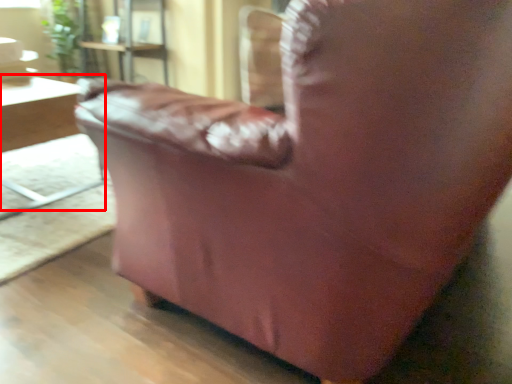
Question: From the image's perspective, where is table (annotated by the red box) located in relation to plant in the image?

Choices:
 (A) below
 (B) above

Answer: (A)